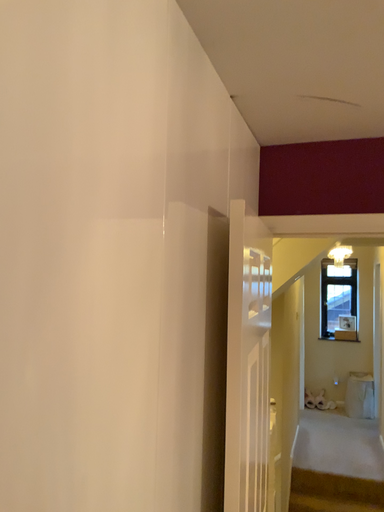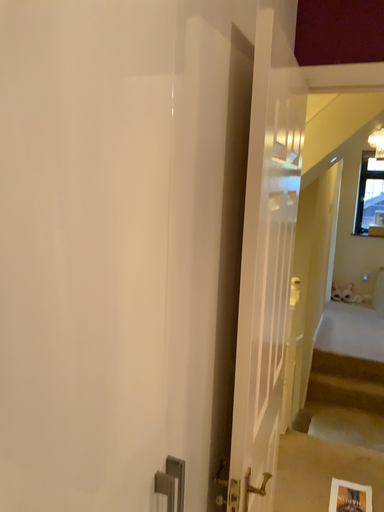
Question: How did the camera likely rotate when shooting the video?

Choices:
 (A) rotated upward
 (B) rotated downward

Answer: (B)